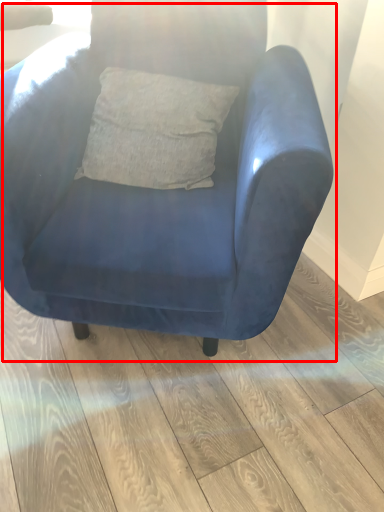
Question: From the image's perspective, what is the correct spatial relationship of chair (annotated by the red box) in relation to plank?

Choices:
 (A) below
 (B) above

Answer: (B)